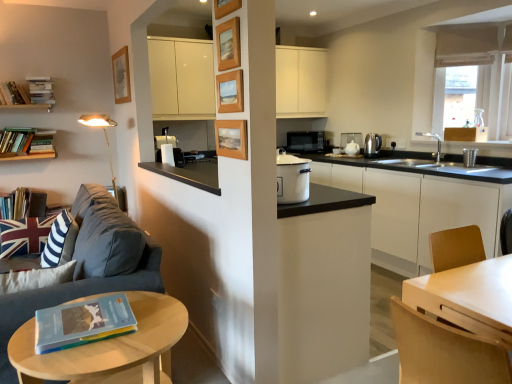
At what (x,y) coordinates should I click in order to perform the action: click on free space above light wood/woodenobject at lower left (from a real-world perspective). Please return your answer as a coordinate pair (x, y). Looking at the image, I should click on (112, 333).